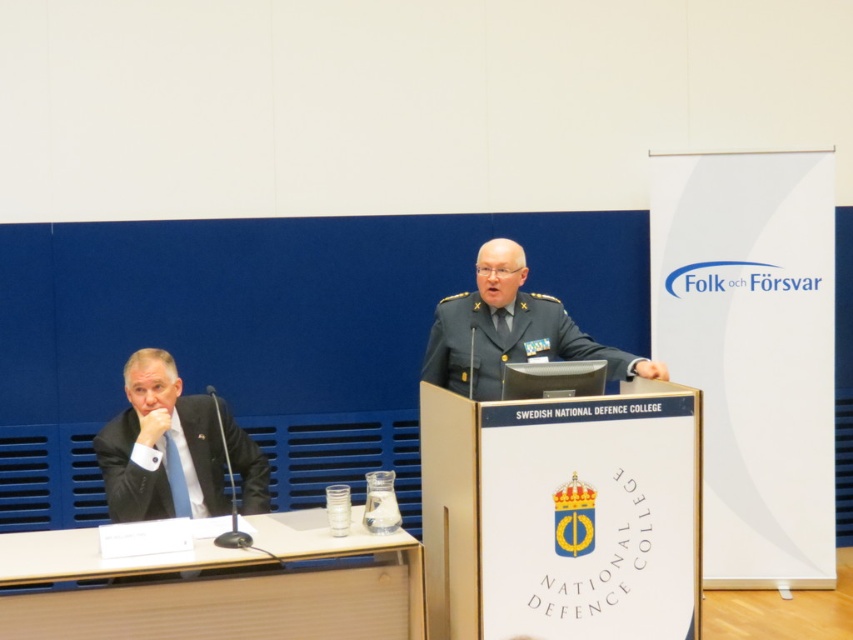
What are the coordinates of `light brown wood table at lower left` in the screenshot? It's located at (248, 595).

This screenshot has height=640, width=853. What do you see at coordinates (248, 595) in the screenshot?
I see `light brown wood table at lower left` at bounding box center [248, 595].

This screenshot has width=853, height=640. In order to click on light brown wood table at lower left in this screenshot , I will do `click(248, 595)`.

Between light brown wood table at lower left and uniformed military officer at center, which one is positioned higher?

uniformed military officer at center is above.

This screenshot has width=853, height=640. I want to click on light brown wood table at lower left, so click(248, 595).

Does black suit at left appear over uniformed military officer at center?

No.

Between black suit at left and uniformed military officer at center, which one appears on the left side from the viewer's perspective?

black suit at left

Which is behind, point (260, 509) or point (450, 324)?

Positioned behind is point (450, 324).

The height and width of the screenshot is (640, 853). I want to click on black suit at left, so click(172, 449).